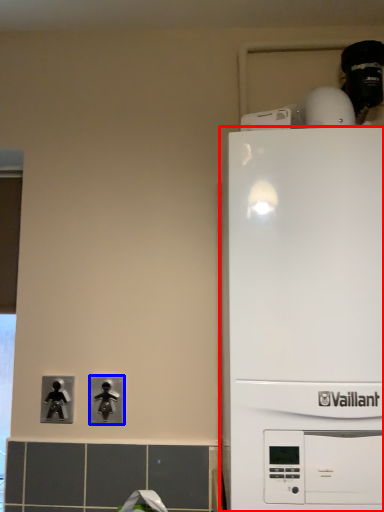
Question: Which object appears closest to the camera in this image, home appliance (highlighted by a red box) or light switch (highlighted by a blue box)?

Choices:
 (A) home appliance
 (B) light switch

Answer: (A)